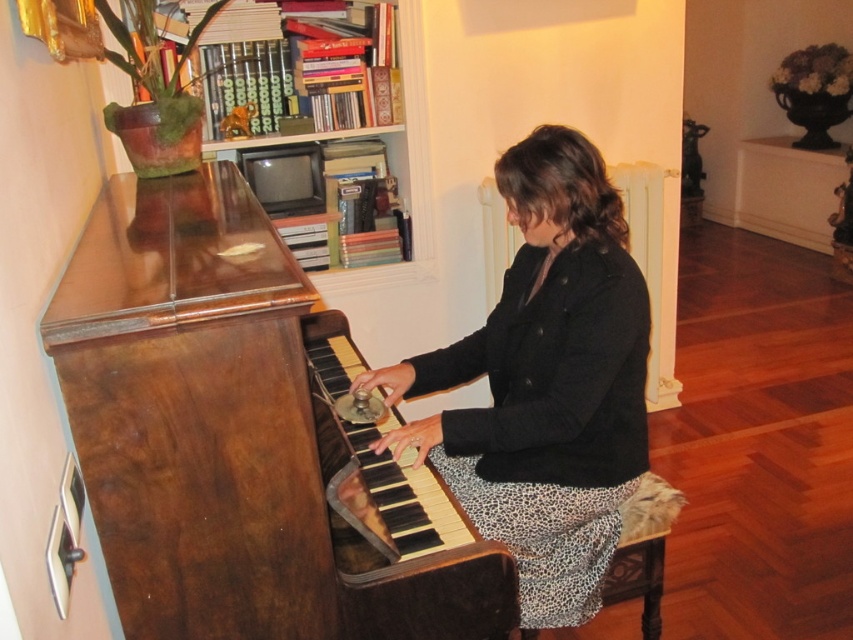
You are a furniture designer who needs to determine if the shiny brown piano at center can fit under a low ceiling. The wooden bookshelf at upper center is 1.8 meters tall. Can the piano fit under a 1.5 meter ceiling?

The shiny brown piano at center is shorter than the wooden bookshelf at upper center, which is 1.8 meters tall. Since the piano is shorter than the bookshelf, its height is less than 1.8 meters. Therefore, the piano can fit under a 1.5 meter ceiling if its height is under 1.5 meters. However, without knowing the exact height of the piano, we cannot confirm for certain. But since it is shorter than the 1.8m bookshelf, it might be possible depending on the piano model.

You are organizing a small concert in the room and need to place a 1.2 meter wide amplifier next to the black textured coat at center and leopard print fabric at lower center. Based on their sizes, can the amplifier fit between them without overlapping?

The black textured coat at center is wider than the leopard print fabric at lower center. Since the amplifier is 1.2 meters wide, and the coat is wider, there might be enough space between them to fit the amplifier, but the exact placement depends on their exact positions and the total available space between them.

You are standing in front of the shiny brown piano at center. If you want to place a 12 inch wide music book on the piano, will it fit?

The shiny brown piano at center is 33.25 inches away from viewer. The question about the music book fitting on the piano cannot be answered with the provided information as the piano dimensions are not specified.